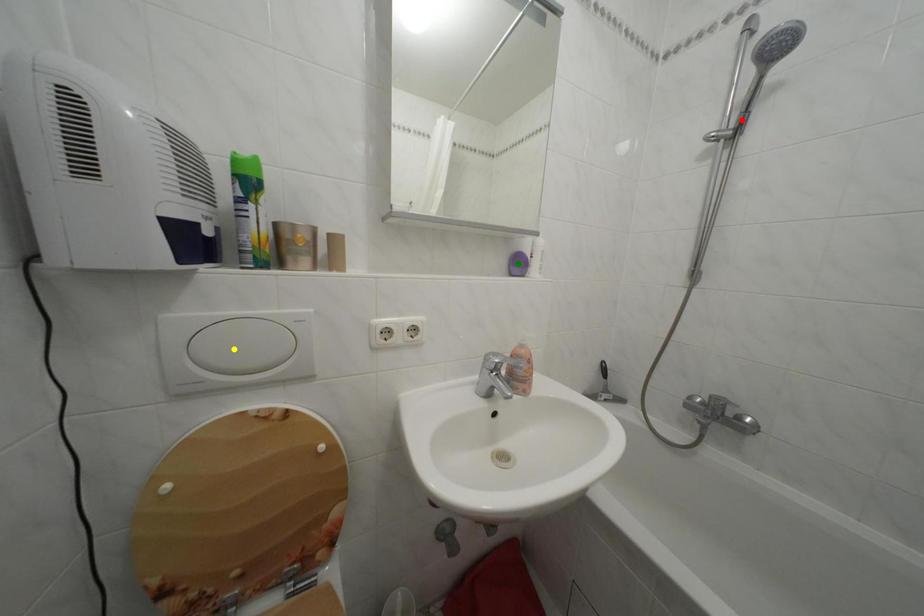
Order these from nearest to farthest:
yellow point, green point, red point

yellow point < red point < green point